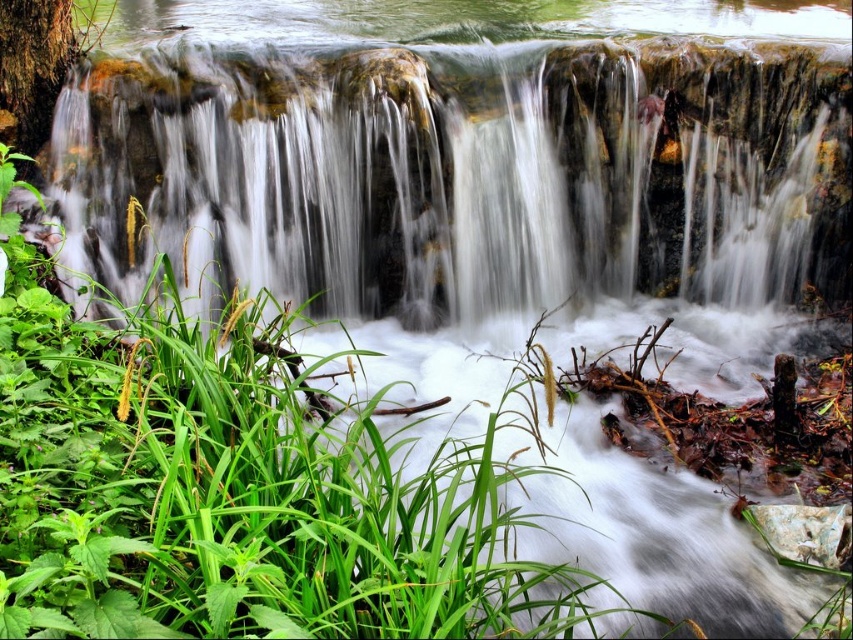
You are a photographer planning to capture the waterfall and the grass in the scene. You want to ensure that both the translucent stone waterfall at upper center and the green leafy grass at center are visible in your shot. Based on their sizes, which object should you focus on to frame the shot properly?

The green leafy grass at center is wider than the translucent stone waterfall at upper center, so you should focus on the green leafy grass at center to frame the shot properly as it occupies more space in the scene.

You are a photographer standing at the edge of the stream. You want to capture a photo that includes both the translucent stone waterfall at upper center and the green leafy grass at center. Based on their positions, which object should you adjust your camera angle to focus on first to ensure both are in the frame?

The translucent stone waterfall at upper center is positioned on the right side of green leafy grass at center. To include both in the frame, you should first focus on the translucent stone waterfall at upper center, which is on the right, and then adjust to include the green leafy grass at center on the left side.